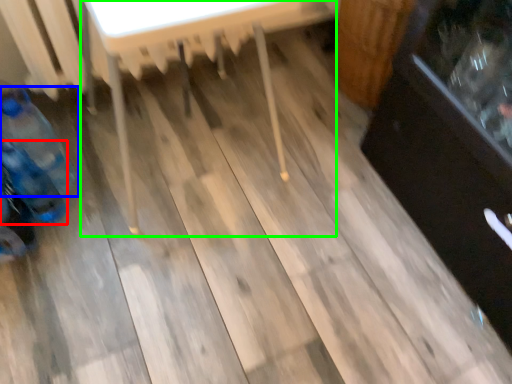
Question: Which is farther away from bottle (highlighted by a red box)? bottle (highlighted by a blue box) or table (highlighted by a green box)?

Choices:
 (A) bottle
 (B) table

Answer: (B)